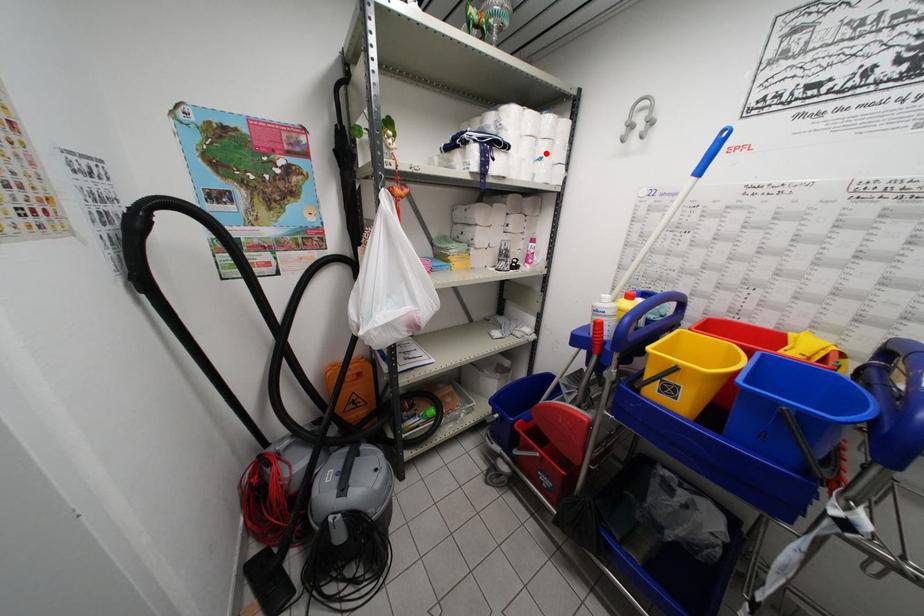
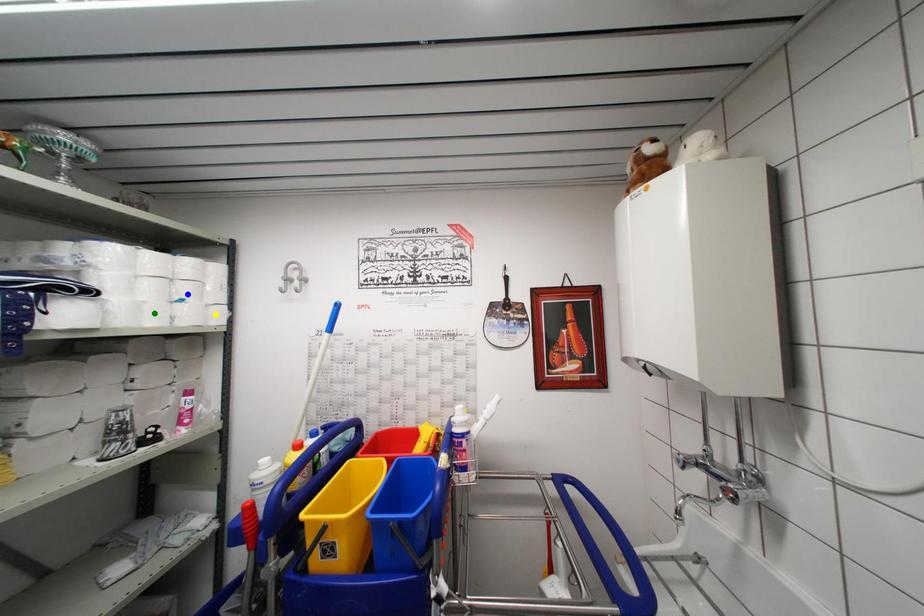
Question: I am providing you with two images of the same scene from different viewpoints. A red point is marked on the first image. You are given multiple points on the second image. In image 2, which mark is for the same physical point as the one in image 1?

Choices:
 (A) blue point
 (B) yellow point
 (C) green point

Answer: (A)